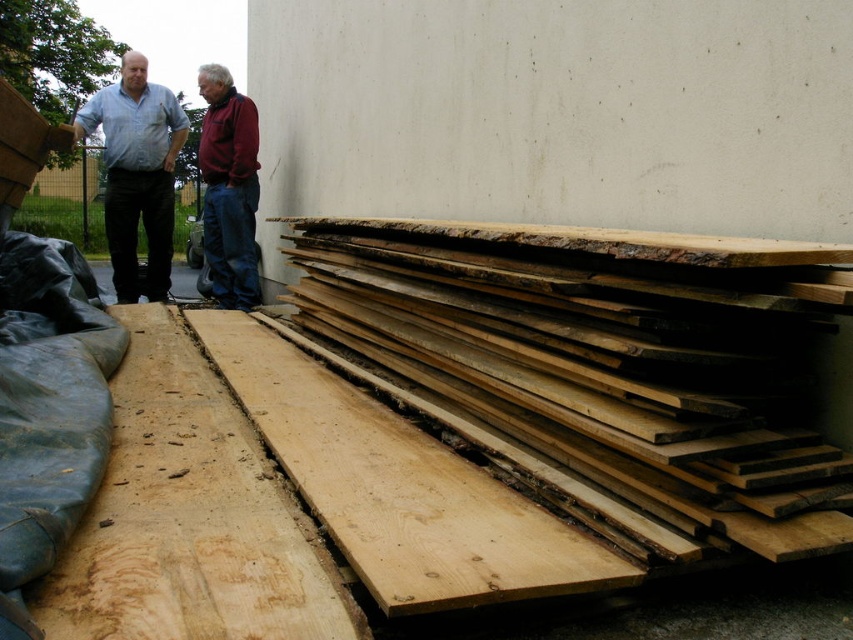
Question: In this image, where is light blue shirt at left located relative to maroon fleece jacket at center?

Choices:
 (A) above
 (B) below

Answer: (A)

Question: Is natural wood boards at right positioned before natural wood plank at center?

Choices:
 (A) yes
 (B) no

Answer: (B)

Question: Which point is farther from the camera taking this photo?

Choices:
 (A) (33, 611)
 (B) (170, 122)
 (C) (485, 488)

Answer: (B)

Question: Which of the following is the farthest from the observer?

Choices:
 (A) natural wood plank at lower left
 (B) maroon fleece jacket at center
 (C) natural wood boards at right
 (D) light blue shirt at left

Answer: (B)

Question: Is the position of natural wood boards at right less distant than that of natural wood plank at lower left?

Choices:
 (A) no
 (B) yes

Answer: (A)

Question: Which object appears closest to the camera in this image?

Choices:
 (A) light blue shirt at left
 (B) natural wood boards at right
 (C) natural wood plank at lower left
 (D) natural wood plank at center

Answer: (C)